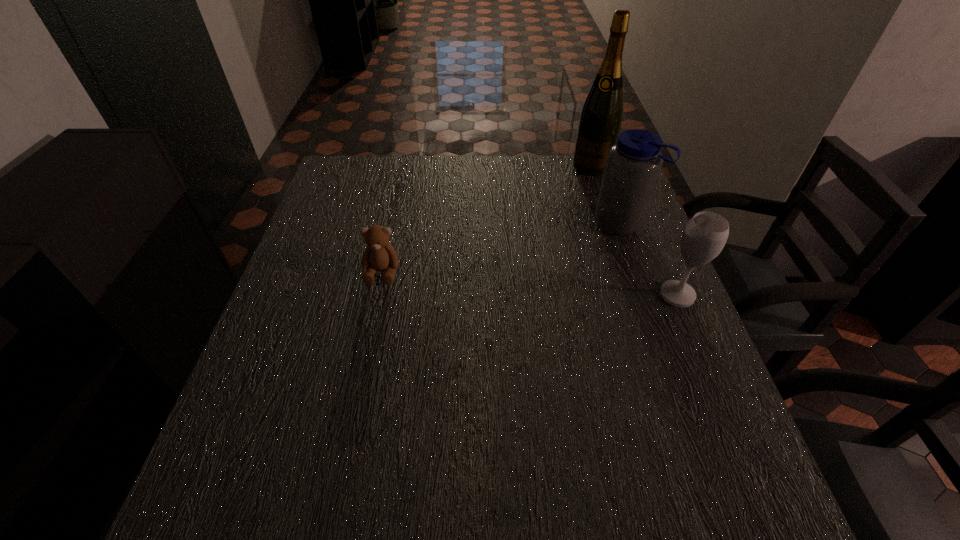
This screenshot has height=540, width=960. Identify the location of vacant area between the second farthest object and the second shortest object. (649, 258).

I want to click on vacant point located between the farthest object and the leftmost object, so point(487,219).

You are a GUI agent. You are given a task and a screenshot of the screen. Output one action in this format:
    pyautogui.click(x=<x>, y=<y>)
    Task: Click on the vacant space that's between the second shortest object and the water bottle
    The image size is (960, 540).
    Given the screenshot: What is the action you would take?
    pyautogui.click(x=649, y=258)

You are a GUI agent. You are given a task and a screenshot of the screen. Output one action in this format:
    pyautogui.click(x=<x>, y=<y>)
    Task: Click on the object that stands as the second closest to the third nearest object
    
    Given the screenshot: What is the action you would take?
    pyautogui.click(x=704, y=236)

Select which object appears as the second closest to the wineglass. Please provide its 2D coordinates. Your answer should be formatted as a tuple, i.e. [(x, y)], where the tuple contains the x and y coordinates of a point satisfying the conditions above.

[(600, 121)]

Identify the location of free space in the image that satisfies the following two spatial constraints: 1. on the face of the wineglass; 2. on the right side of the shortest object. The image size is (960, 540). (377, 295).

Identify the location of free region that satisfies the following two spatial constraints: 1. on the face of the teddy bear; 2. on the left side of the third tallest object. (377, 295).